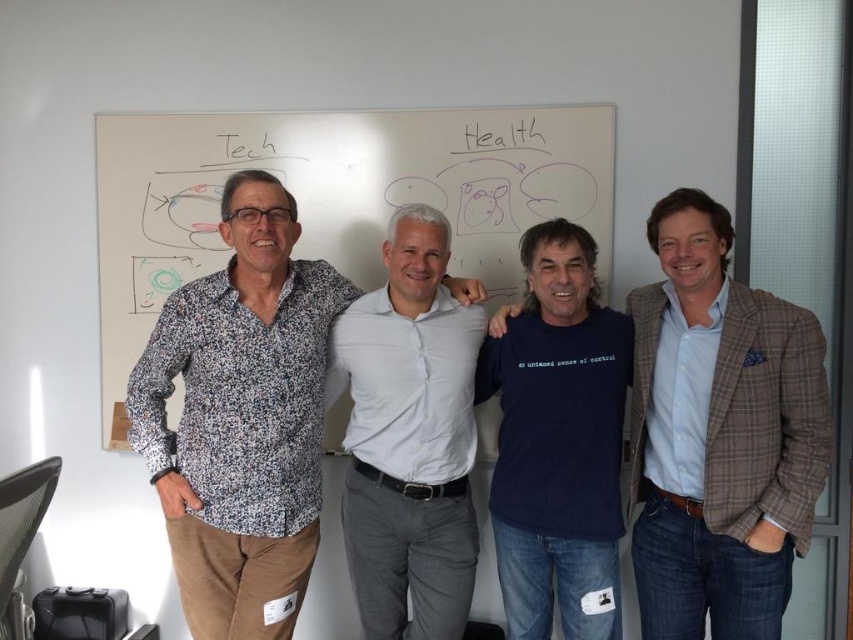
Who is positioned more to the left, printed cotton shirt at center or white cotton shirt at center?

From the viewer's perspective, printed cotton shirt at center appears more on the left side.

Does printed cotton shirt at center have a lesser height compared to white cotton shirt at center?

Yes.

Is point (277, 372) more distant than point (397, 257)?

No, (277, 372) is in front of (397, 257).

Locate an element on the screen. This screenshot has width=853, height=640. printed cotton shirt at center is located at coordinates (241, 419).

Is point (397, 632) closer to viewer compared to point (543, 273)?

That is False.

Where is `white cotton shirt at center`? This screenshot has width=853, height=640. white cotton shirt at center is located at coordinates (410, 435).

Is dark blue t-shirt at center to the left of dark blue cotton t-shirt at center from the viewer's perspective?

In fact, dark blue t-shirt at center is to the right of dark blue cotton t-shirt at center.

Is dark blue t-shirt at center to the right of dark blue cotton t-shirt at center from the viewer's perspective?

Indeed, dark blue t-shirt at center is positioned on the right side of dark blue cotton t-shirt at center.

Is point (791, 483) behind point (581, 556)?

That is False.

At what (x,y) coordinates should I click in order to perform the action: click on dark blue t-shirt at center. Please return your answer as a coordinate pair (x, y). Looking at the image, I should click on [x=718, y=435].